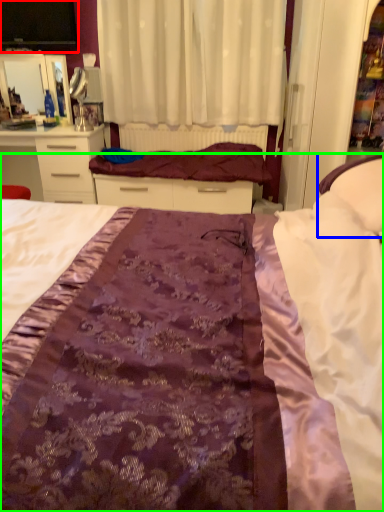
Question: Estimate the real-world distances between objects in this image. Which object is closer to desktop (highlighted by a red box), pillow (highlighted by a blue box) or bed (highlighted by a green box)?

Choices:
 (A) pillow
 (B) bed

Answer: (A)